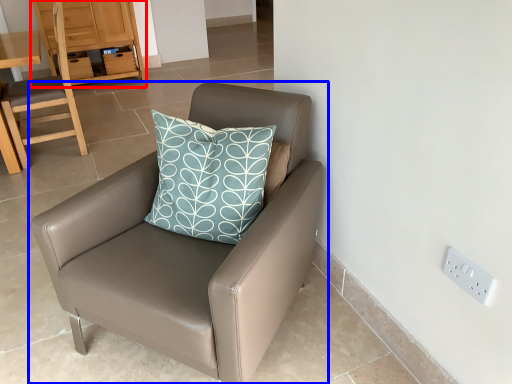
Question: Among these objects, which one is farthest to the camera, dresser (highlighted by a red box) or chair (highlighted by a blue box)?

Choices:
 (A) dresser
 (B) chair

Answer: (A)